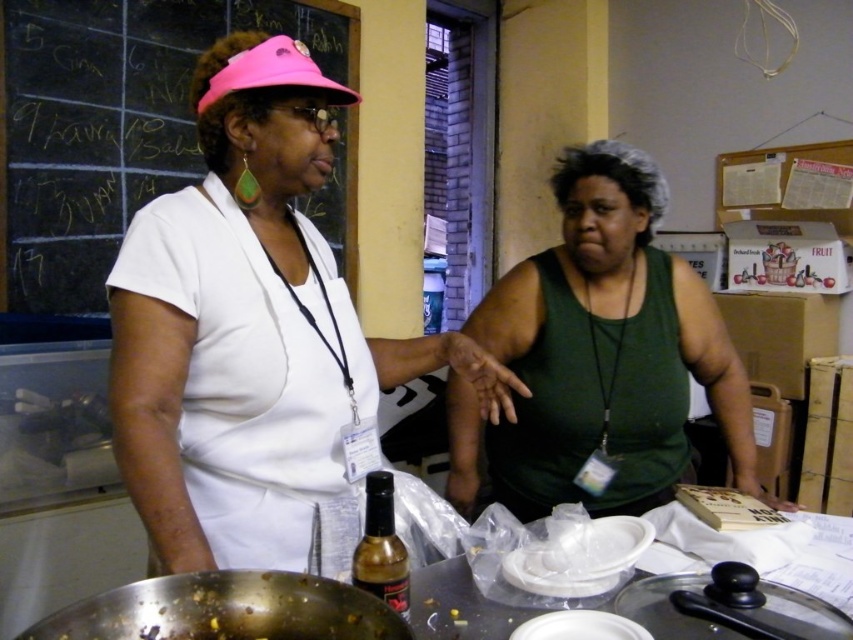
You are standing in the kitchen and need to place a small plant between the two points, point (335, 29) and point (375, 577). According to the coordinates, which point should the plant be closer to?

The plant should be placed closer to point (375, 577) because point (335, 29) is behind it, so the front point is (375, 577).

From the picture: You are a guest at an event and see the chalkboard at upper left and the shiny brown glass bottle at center. Which object is wider?

The chalkboard at upper left might be wider than the shiny brown glass bottle at center according to the description.

You are a delivery person who needs to place a 15 inch box on the translucent plastic table at center without touching the green matte tank top at center. Is there enough space between them?

The distance between the green matte tank top at center and the translucent plastic table at center is 16.73 inches. Since the box is 15 inches wide, there is enough space to place it without touching the tank top.